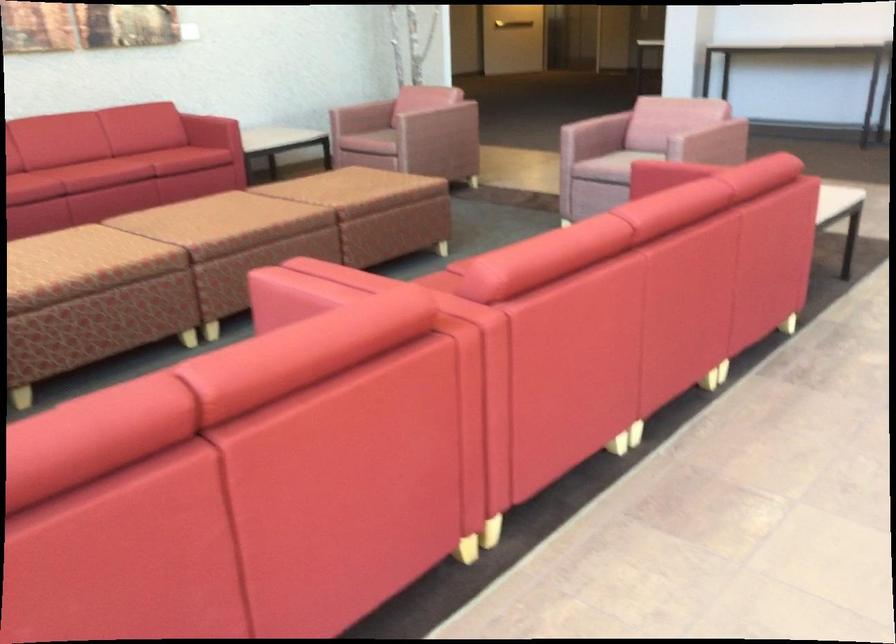
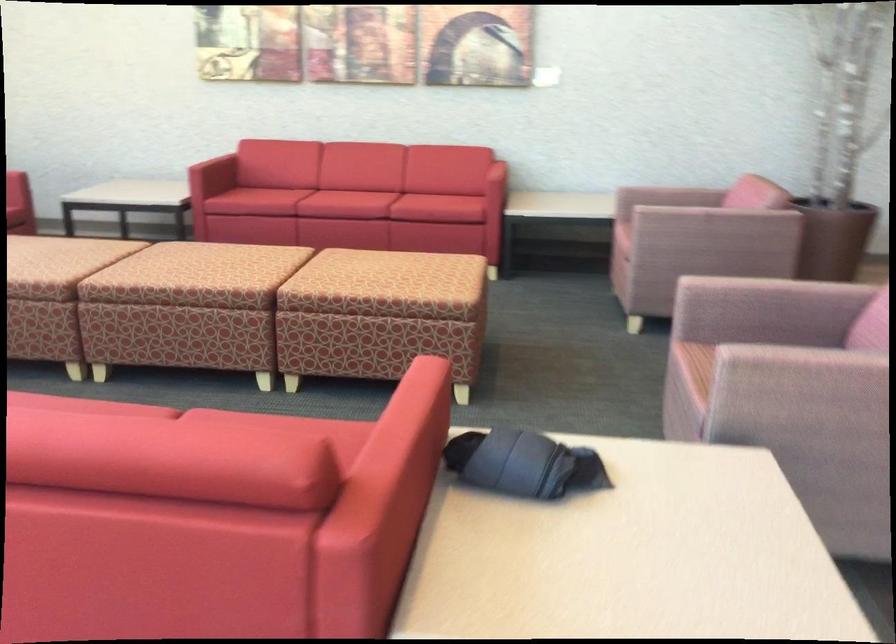
Where in the second image is the point corresponding to [600,147] from the first image?

(760, 330)